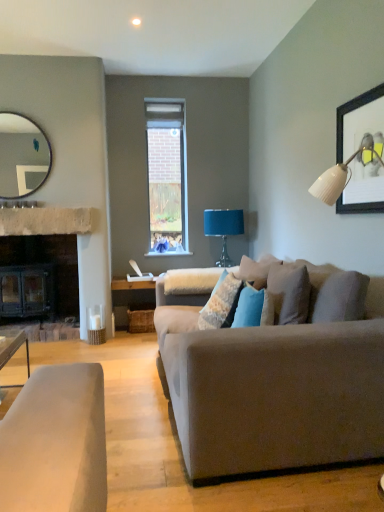
This screenshot has width=384, height=512. Find the location of `vacant area on top of natural stone mantle at left (from a real-world perspective)`. vacant area on top of natural stone mantle at left (from a real-world perspective) is located at coordinates (53, 205).